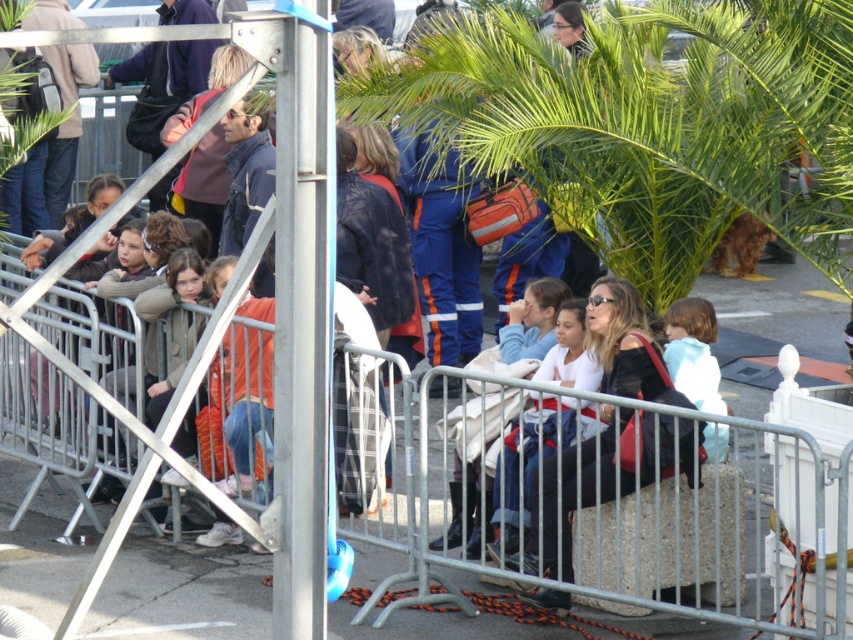
Between matte black jacket at center and light blue fabric at center, which one has less height?

With less height is light blue fabric at center.

Does matte black jacket at center appear on the right side of light blue fabric at center?

No, matte black jacket at center is not to the right of light blue fabric at center.

Is point (585, 476) less distant than point (717, 406)?

Yes.

Where is `matte black jacket at center`? The height and width of the screenshot is (640, 853). matte black jacket at center is located at coordinates (625, 342).

Can you confirm if matte black jacket at center is positioned to the right of light blue denim jacket at center?

Yes, matte black jacket at center is to the right of light blue denim jacket at center.

Measure the distance between matte black jacket at center and light blue denim jacket at center.

The distance of matte black jacket at center from light blue denim jacket at center is 1.24 meters.

Is point (619, 378) closer to viewer compared to point (518, 353)?

That is True.

Locate an element on the screen. The width and height of the screenshot is (853, 640). matte black jacket at center is located at coordinates (625, 342).

Between silver metallic pole at center and light blue fabric at center, which one has more height?

silver metallic pole at center is taller.

Does point (289, 49) come behind point (717, 403)?

No, it is in front of (717, 403).

You are a GUI agent. You are given a task and a screenshot of the screen. Output one action in this format:
    pyautogui.click(x=<x>, y=<y>)
    Task: Click on the silver metallic pole at center
    The height and width of the screenshot is (640, 853).
    Given the screenshot: What is the action you would take?
    pyautogui.click(x=300, y=328)